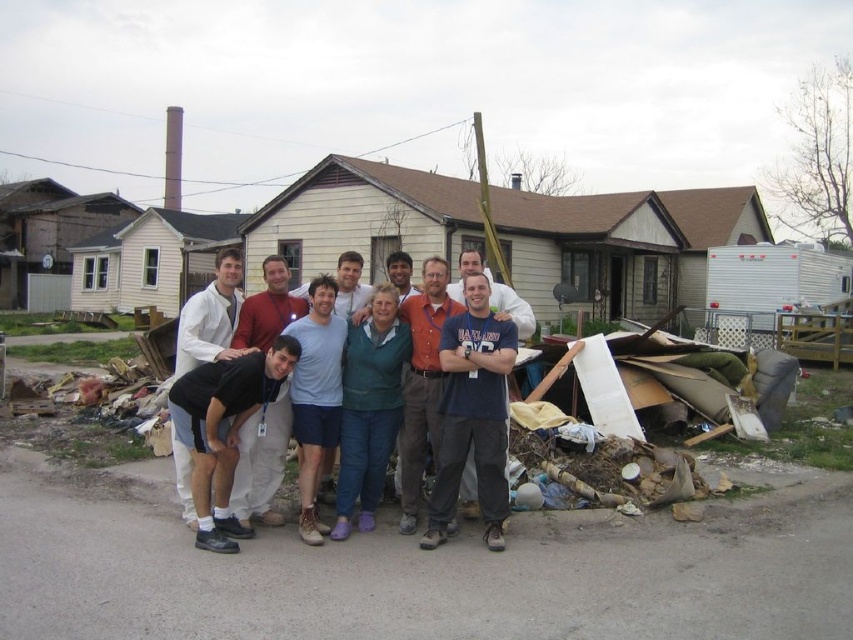
You are taking a photo of the group and notice two items at the center of the image. The matte white shirt at center and the black fabric at center. Which one appears taller in the photo?

The matte white shirt at center appears taller than the black fabric at center in the photo.

You are a photographer taking a photo of the group in front of the house. You notice a point at coordinates (247, 413) in the image. What object is located at this point?

The point at coordinates (247, 413) corresponds to the matte white shirt at center.